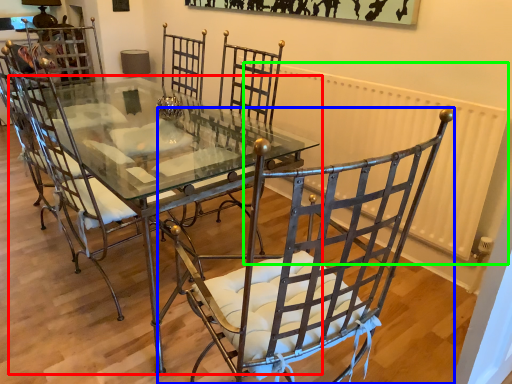
Question: Which object is the closest to the table (highlighted by a red box)? Choose among these: chair (highlighted by a blue box) or radiator (highlighted by a green box).

Choices:
 (A) chair
 (B) radiator

Answer: (A)